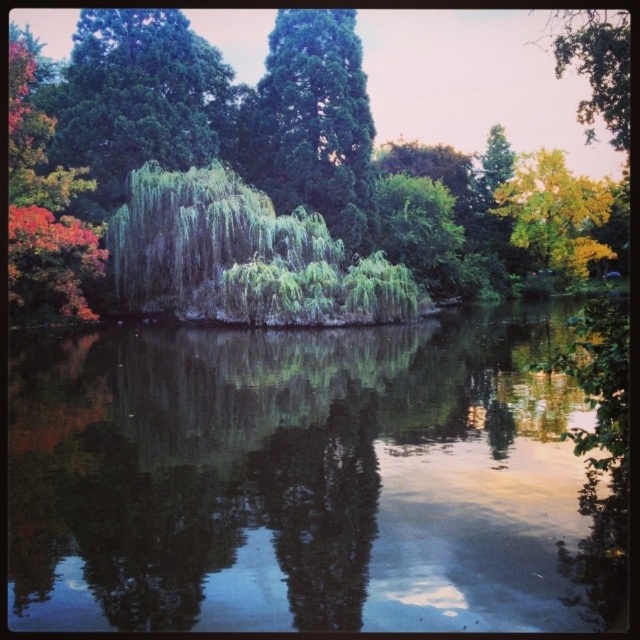
Question: Based on their relative distances, which object is nearer to the green leafy tree at center?

Choices:
 (A) green reflective water at center
 (B) yellow-green leafy willow at upper right

Answer: (B)

Question: Which of these objects is positioned farthest from the green leafy willow at center?

Choices:
 (A) yellow-green leafy willow at upper right
 (B) green leafy tree at center

Answer: (A)

Question: Does green leafy tree at center appear on the right side of green leafy tree at upper left?

Choices:
 (A) no
 (B) yes

Answer: (B)

Question: Is green leafy tree at center thinner than yellow-green leafy willow at upper right?

Choices:
 (A) no
 (B) yes

Answer: (A)

Question: Which point is farther to the camera?

Choices:
 (A) green leafy tree at upper left
 (B) green leafy willow at center

Answer: (A)

Question: Does green leafy tree at center lie in front of yellow-green leafy willow at upper right?

Choices:
 (A) no
 (B) yes

Answer: (B)